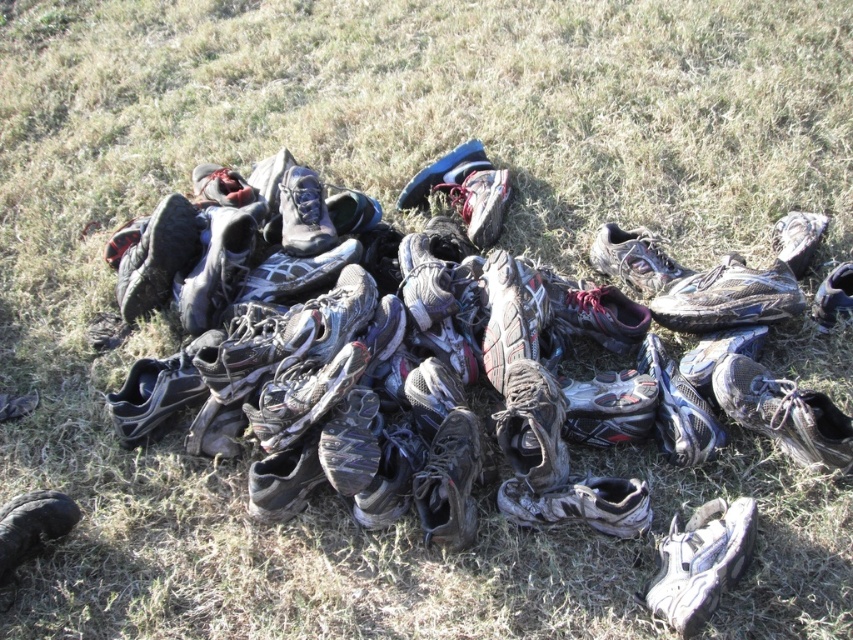
Question: Does gray fabric running shoe at center have a larger size compared to black leather shoe at lower left?

Choices:
 (A) no
 (B) yes

Answer: (B)

Question: Which point is closer to the camera taking this photo?

Choices:
 (A) (689, 634)
 (B) (799, 266)

Answer: (A)

Question: Which object is positioned farthest from the matte gray shoe at upper right?

Choices:
 (A) shiny gray shoe at lower right
 (B) shiny black shoe at lower right
 (C) black leather shoe at lower left

Answer: (C)

Question: Among these points, which one is farthest from the camera?

Choices:
 (A) (712, 596)
 (B) (666, 276)
 (C) (18, 497)

Answer: (B)

Question: Does shiny black shoe at lower right have a larger size compared to camouflage-patterned sneaker at center?

Choices:
 (A) no
 (B) yes

Answer: (A)

Question: Is shiny gray shoe at lower right smaller than matte gray shoe at upper right?

Choices:
 (A) no
 (B) yes

Answer: (A)